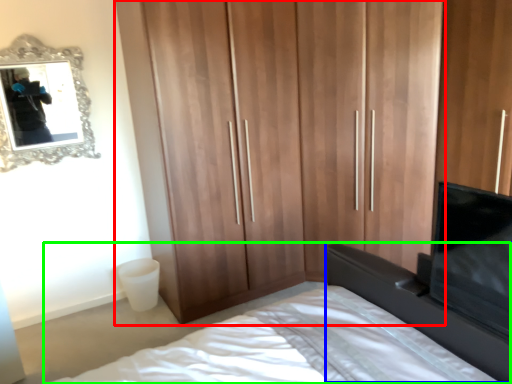
Question: Which object is the farthest from cupboard (highlighted by a red box)? Choose among these: vanity (highlighted by a blue box) or bed (highlighted by a green box).

Choices:
 (A) vanity
 (B) bed

Answer: (A)